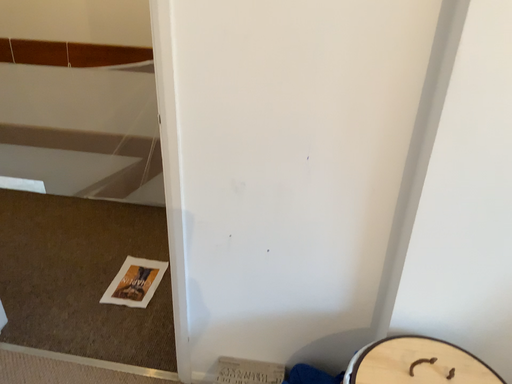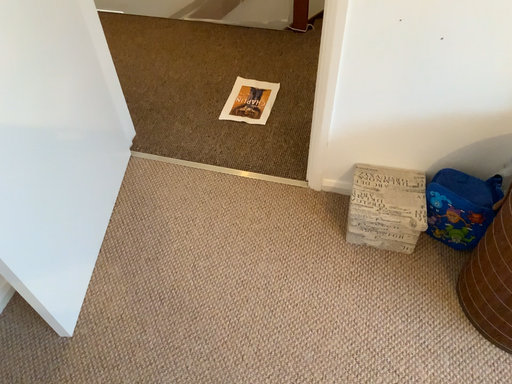
Question: Which way did the camera rotate in the video?

Choices:
 (A) rotated upward
 (B) rotated downward

Answer: (B)